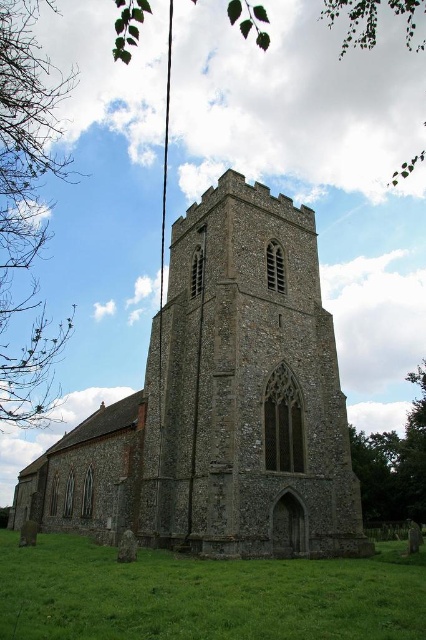
This screenshot has height=640, width=426. What do you see at coordinates (219, 403) in the screenshot? I see `stone church at center` at bounding box center [219, 403].

Can you confirm if stone church at center is shorter than green grass at lower center?

No, stone church at center is not shorter than green grass at lower center.

Is point (74, 452) positioned before point (169, 609)?

No, it is behind (169, 609).

Identify the location of stone church at center. pos(219,403).